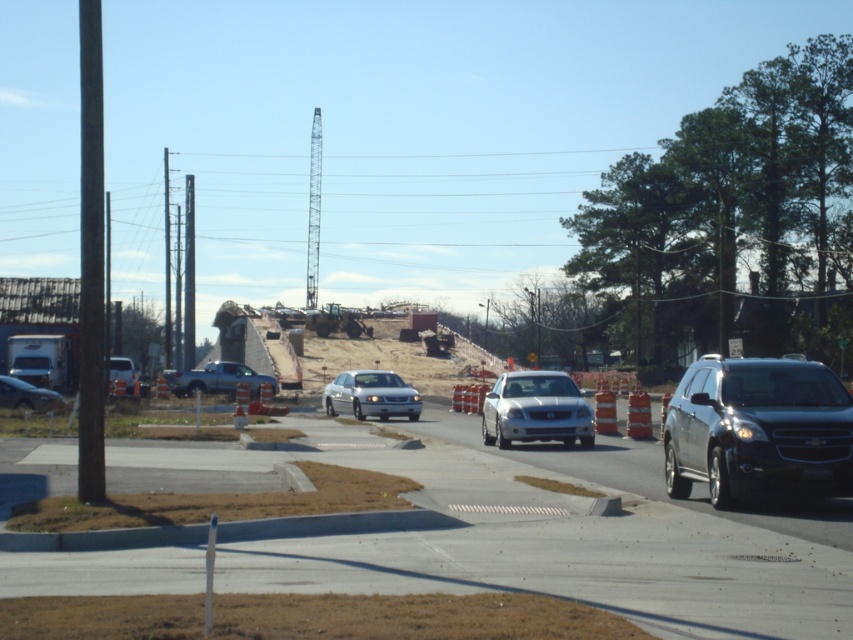
Is silver metallic truck at center positioned in front of matte silver sedan at left?

No.

Image resolution: width=853 pixels, height=640 pixels. Identify the location of silver metallic truck at center. (218, 380).

Based on the photo, who is more distant from viewer, (202, 388) or (126, 356)?

The point (126, 356) is behind.

Where is `silver metallic truck at center`? silver metallic truck at center is located at coordinates coord(218,380).

Does point (825, 483) come in front of point (242, 369)?

Yes, it is.

Does point (849, 493) come in front of point (204, 392)?

That is True.

Find the location of `satin black suv at right`. satin black suv at right is located at coordinates (757, 429).

Does orange traffic cones at center appear under silver metallic sedan at center?

Correct, orange traffic cones at center is located below silver metallic sedan at center.

Which is in front, point (171, 458) or point (506, 385)?

Point (171, 458)

At what (x,y) coordinates should I click in order to perform the action: click on orange traffic cones at center. Please return your answer as a coordinate pair (x, y). The image size is (853, 640). Looking at the image, I should click on (515, 540).